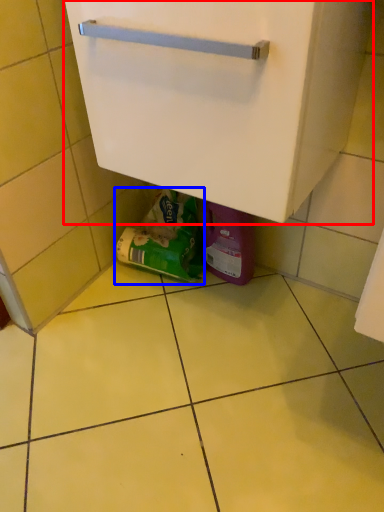
Question: Which of the following is the farthest to the observer, cabinetry (highlighted by a red box) or garbage (highlighted by a blue box)?

Choices:
 (A) cabinetry
 (B) garbage

Answer: (B)